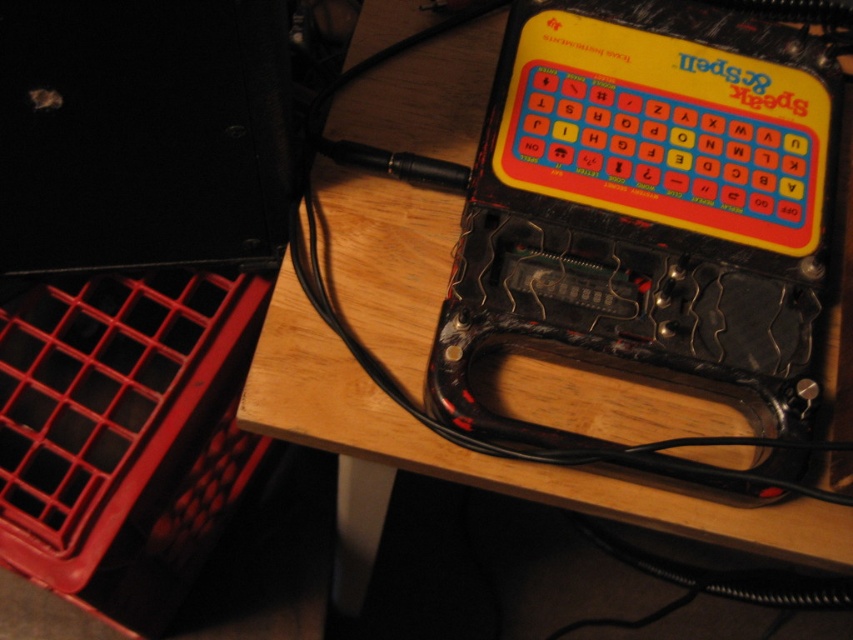
You are setting up a display for a retro gaming event and need to place the Speak and Spell toy on the wooden table at upper center. However, you also have a red plastic crate at lower left that needs to be positioned nearby. Considering their sizes, which object should you prioritize placing first to ensure both fit on the table?

The wooden table at upper center is larger in size than the red plastic crate at lower left, so you should prioritize placing the red plastic crate at lower left first since it is smaller and easier to position around the larger wooden table at upper center.

Based on the photo, you are looking at the vintage Speak and Spell device and two points on its surface. Based on your observation, which point is closer to you, point (x=392, y=429) or point (x=32, y=352)?

Point (x=392, y=429) is closer to the camera than point (x=32, y=352).

You are arranging items on the wooden table at upper center and the red plastic crate at lower left. Which object is located to the right of the other?

The wooden table at upper center is positioned on the right side of the red plastic crate at lower left, so the wooden table at upper center is to the right of the red plastic crate at lower left.